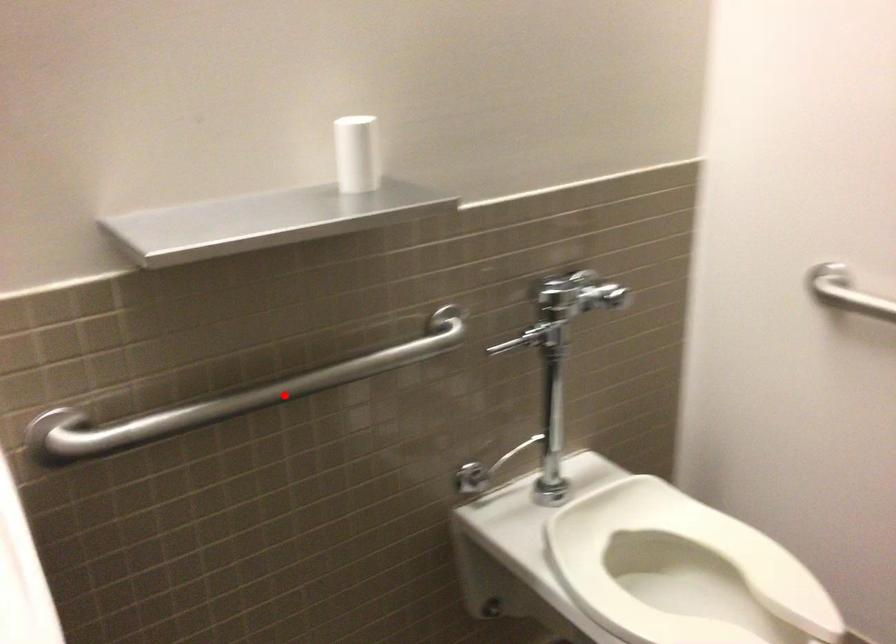
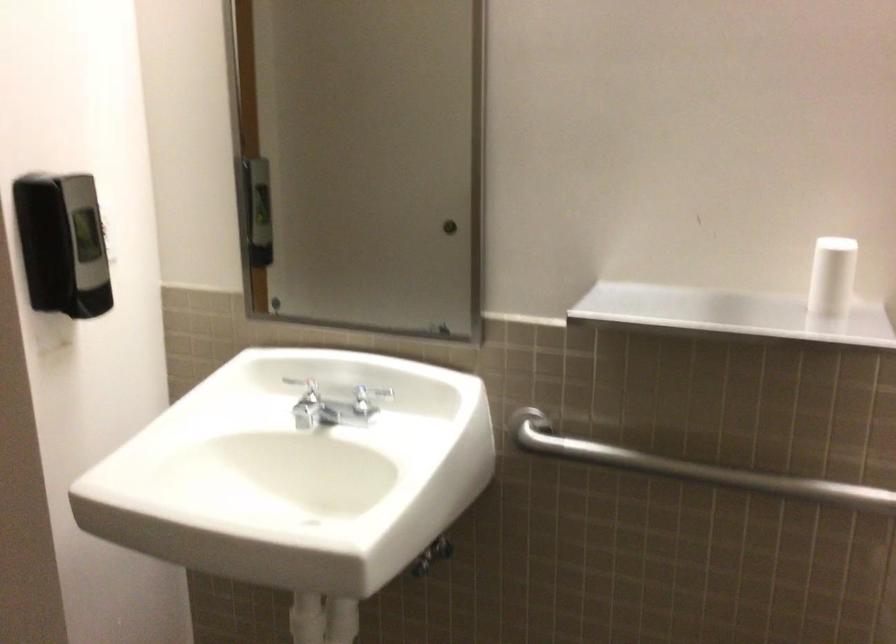
Where in the second image is the point corresponding to the highlighted location from the first image?

(691, 468)